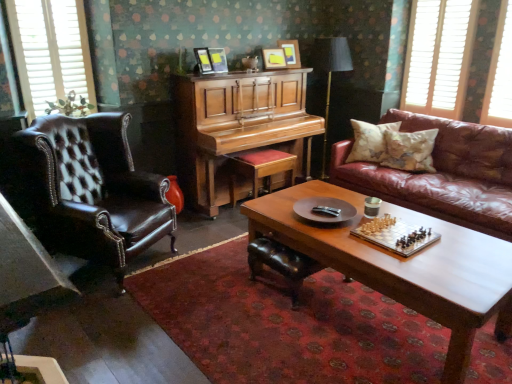
Question: In terms of width, does metallic chess set at center look wider or thinner when compared to leather footrest at center?

Choices:
 (A) wide
 (B) thin

Answer: (B)

Question: In the image, is metallic chess set at center on the left side or the right side of leather footrest at center?

Choices:
 (A) left
 (B) right

Answer: (B)

Question: Estimate the real-world distances between objects in this image. Which object is closer to the white wooden blinds at upper right, placed as the third window when sorted from left to right?

Choices:
 (A) matte wooden picture frame at upper center, which appears as the fourth picture frame when viewed from the right
 (B) brown leather couch at right
 (C) wooden cushioned stool at center
 (D) brown leather wingback chair at left
 (E) leather cushion at right, placed as the 2th pillow when sorted from right to left

Answer: (B)

Question: Considering the real-world distances, which object is farthest from the matte wooden picture frame at upper center, which is counted as the 3th picture frame, starting from the right?

Choices:
 (A) wooden picture frame at upper center, the fourth picture frame positioned from the left
 (B) metallic chess set at center
 (C) brown leather couch at right
 (D) white wooden blinds at upper right, placed as the third window when sorted from left to right
 (E) matte black table lamp at center

Answer: (D)